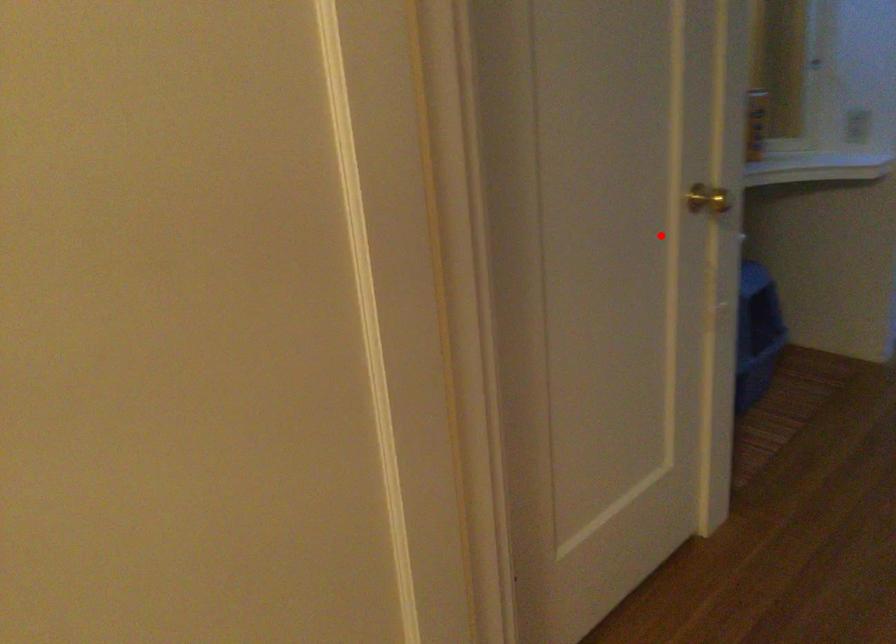
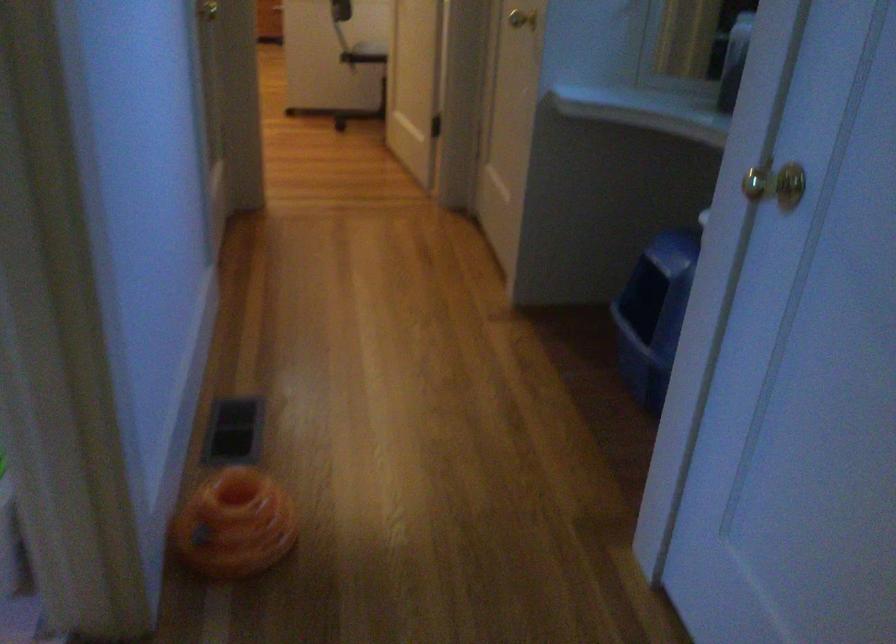
Where in the second image is the point corresponding to the highlighted location from the first image?

(521, 19)